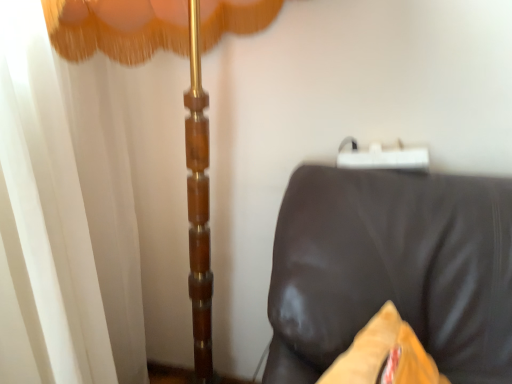
Where is `white sheer curtain at left`? This screenshot has height=384, width=512. white sheer curtain at left is located at coordinates (184, 97).

Describe the element at coordinates (184, 97) in the screenshot. The width and height of the screenshot is (512, 384). I see `white sheer curtain at left` at that location.

Identify the location of brown leather couch at lower right. Image resolution: width=512 pixels, height=384 pixels. (392, 269).

This screenshot has width=512, height=384. Describe the element at coordinates (392, 269) in the screenshot. I see `brown leather couch at lower right` at that location.

Find the location of a particular element. The image size is (512, 384). white sheer curtain at left is located at coordinates (184, 97).

Which is more to the right, brown leather couch at lower right or white sheer curtain at left?

brown leather couch at lower right is more to the right.

Does brown leather couch at lower right come in front of white sheer curtain at left?

Yes, brown leather couch at lower right is in front of white sheer curtain at left.

Is point (480, 217) closer to camera compared to point (203, 310)?

Yes, point (480, 217) is closer to viewer.

From the image's perspective, is brown leather couch at lower right under white sheer curtain at left?

Correct, brown leather couch at lower right appears lower than white sheer curtain at left in the image.

Looking at this image, from a real-world perspective, is brown leather couch at lower right positioned under white sheer curtain at left based on gravity?

Correct, in the physical world, brown leather couch at lower right is lower than white sheer curtain at left.

Is brown leather couch at lower right wider or thinner than white sheer curtain at left?

Clearly, brown leather couch at lower right has less width compared to white sheer curtain at left.

Who is shorter, brown leather couch at lower right or white sheer curtain at left?

brown leather couch at lower right.

Considering the relative sizes of brown leather couch at lower right and white sheer curtain at left in the image provided, is brown leather couch at lower right bigger than white sheer curtain at left?

Actually, brown leather couch at lower right might be smaller than white sheer curtain at left.

Is brown leather couch at lower right not inside white sheer curtain at left?

Yes, brown leather couch at lower right is located beyond the bounds of white sheer curtain at left.

Is brown leather couch at lower right far from white sheer curtain at left?

No, there isn't a large distance between brown leather couch at lower right and white sheer curtain at left.

Could you tell me if brown leather couch at lower right is turned towards white sheer curtain at left?

No, brown leather couch at lower right is not oriented towards white sheer curtain at left.

How many degrees apart are the facing directions of brown leather couch at lower right and white sheer curtain at left?

The angular difference between brown leather couch at lower right and white sheer curtain at left is 69.2 degrees.

The image size is (512, 384). I want to click on furniture beneath the white sheer curtain at left (from a real-world perspective), so click(x=392, y=269).

Based on the photo, can you confirm if white sheer curtain at left is positioned to the left of brown leather couch at lower right?

Indeed, white sheer curtain at left is positioned on the left side of brown leather couch at lower right.

Does white sheer curtain at left lie behind brown leather couch at lower right?

Yes, it is.

Does point (157, 5) come farther from viewer compared to point (447, 369)?

Yes, it is behind point (447, 369).

From the image's perspective, which is below, white sheer curtain at left or brown leather couch at lower right?

brown leather couch at lower right is shown below in the image.

From a real-world perspective, which is physically above, white sheer curtain at left or brown leather couch at lower right?

white sheer curtain at left is physically above.

Considering the sizes of objects white sheer curtain at left and brown leather couch at lower right in the image provided, who is wider, white sheer curtain at left or brown leather couch at lower right?

white sheer curtain at left.

Which of these two, white sheer curtain at left or brown leather couch at lower right, stands shorter?

brown leather couch at lower right is shorter.

Between white sheer curtain at left and brown leather couch at lower right, which one has larger size?

white sheer curtain at left.

Is white sheer curtain at left inside the boundaries of brown leather couch at lower right, or outside?

The correct answer is: outside.

Is white sheer curtain at left not near brown leather couch at lower right?

No, white sheer curtain at left is not far away from brown leather couch at lower right.

Could you tell me if white sheer curtain at left is turned towards brown leather couch at lower right?

No, white sheer curtain at left does not turn towards brown leather couch at lower right.

Can you tell me how much white sheer curtain at left and brown leather couch at lower right differ in facing direction?

The facing directions of white sheer curtain at left and brown leather couch at lower right are 69.2 degrees apart.

Locate an element on the screen. curtain above the brown leather couch at lower right (from the image's perspective) is located at coordinates (184, 97).

Find the location of a particular element. This screenshot has width=512, height=384. curtain above the brown leather couch at lower right (from a real-world perspective) is located at coordinates (184, 97).

Image resolution: width=512 pixels, height=384 pixels. What are the coordinates of `furniture on the right of the white sheer curtain at left` in the screenshot? It's located at (392, 269).